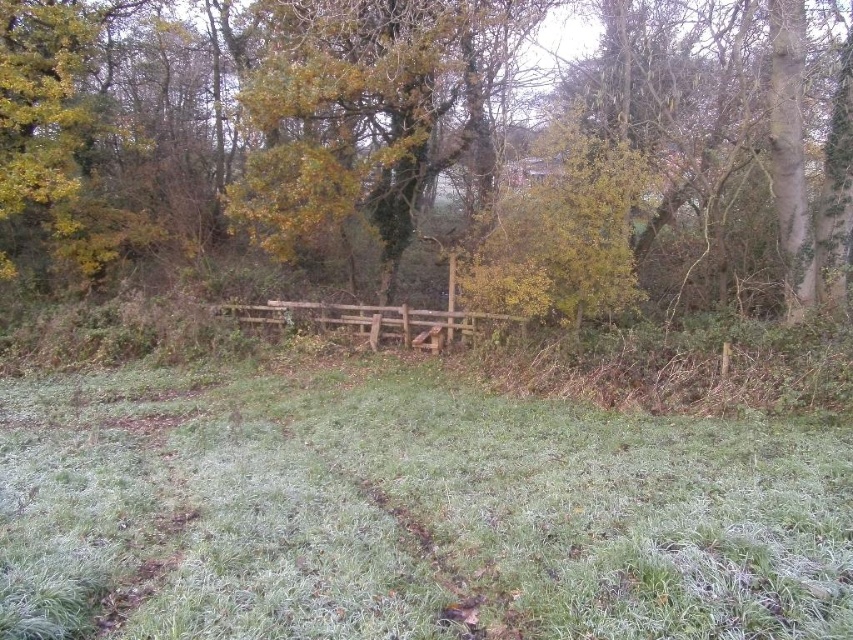
Between point (57, 246) and point (287, 307), which one is positioned in front?

Point (57, 246) is in front.

Which is in front, point (33, 51) or point (317, 317)?

Point (33, 51)

At what (x,y) coordinates should I click in order to perform the action: click on green leafy tree at center. Please return your answer as a coordinate pair (x, y). Image resolution: width=853 pixels, height=640 pixels. Looking at the image, I should click on (538, 148).

Is green grassy at center positioned before wooden fence at center?

Yes, green grassy at center is closer to the viewer.

Between point (647, 582) and point (454, 280), which one is positioned in front?

Positioned in front is point (647, 582).

Image resolution: width=853 pixels, height=640 pixels. Describe the element at coordinates (407, 513) in the screenshot. I see `green grassy at center` at that location.

Locate an element on the screen. This screenshot has height=640, width=853. green grassy at center is located at coordinates (407, 513).

Looking at this image, is green grassy at center above green leafy tree at center?

Actually, green grassy at center is below green leafy tree at center.

Where is `green grassy at center`? green grassy at center is located at coordinates (407, 513).